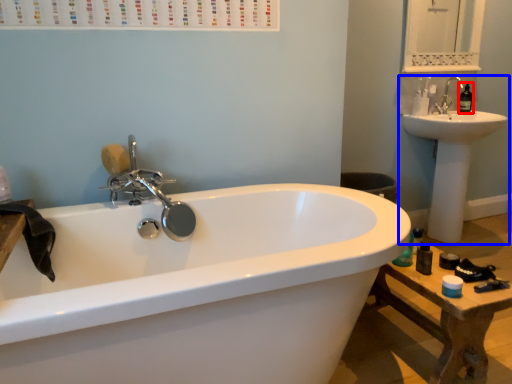
Question: Which point is closer to the camera, soap dispenser (highlighted by a red box) or sink (highlighted by a blue box)?

Choices:
 (A) soap dispenser
 (B) sink

Answer: (B)